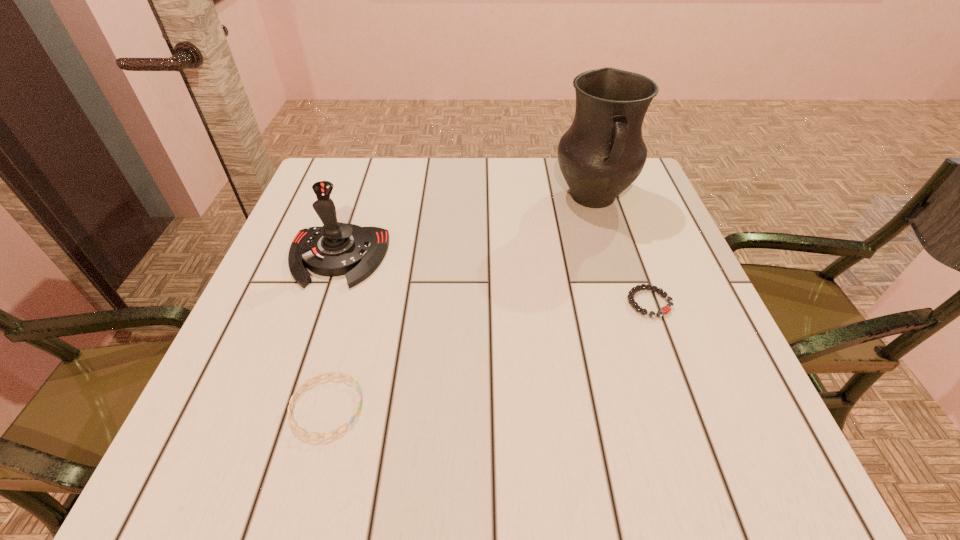
The height and width of the screenshot is (540, 960). What are the coordinates of `vacant space that satisfies the following two spatial constraints: 1. on the front side of the right bracelet; 2. on the surface of the left bracelet showing star-shaped elements` in the screenshot? It's located at (687, 407).